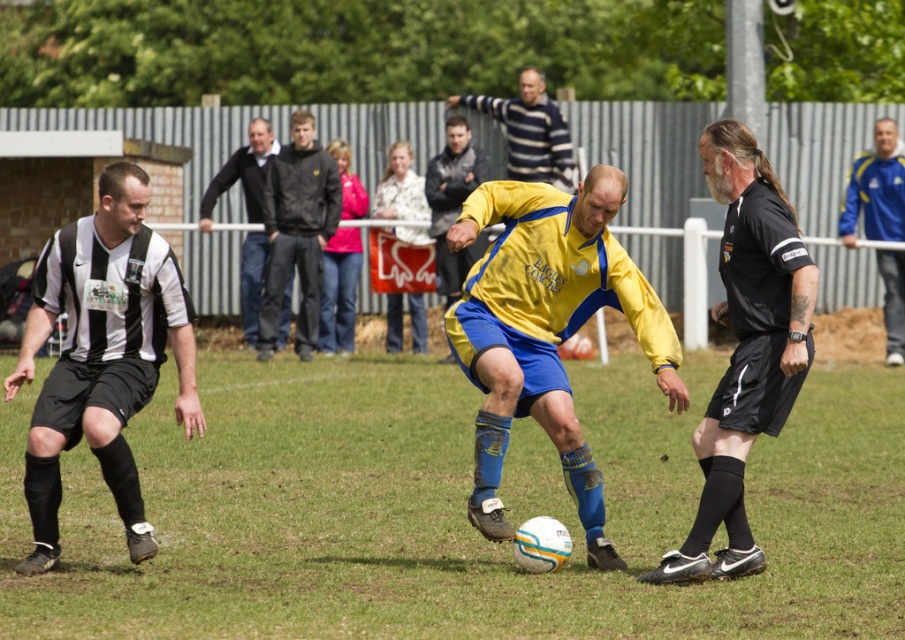
Does white matte soccer ball at center have a greater width compared to black matte referee shirt at right?

Yes, white matte soccer ball at center is wider than black matte referee shirt at right.

Is white matte soccer ball at center behind black matte referee shirt at right?

No, it is in front of black matte referee shirt at right.

Who is more forward, (245, 445) or (736, 332)?

Point (736, 332) is more forward.

At what (x,y) coordinates should I click in order to perform the action: click on white matte soccer ball at center. Please return your answer as a coordinate pair (x, y). This screenshot has width=905, height=640. Looking at the image, I should click on (456, 512).

Is point (443, 609) farther from camera compared to point (129, 396)?

No, (443, 609) is closer to viewer.

Which of these two, white matte soccer ball at center or black and white jersey at left, stands shorter?

Standing shorter between the two is white matte soccer ball at center.

Does point (322, 566) come farther from viewer compared to point (83, 396)?

Yes, it is behind point (83, 396).

Locate an element on the screen. The height and width of the screenshot is (640, 905). white matte soccer ball at center is located at coordinates (456, 512).

Does white matte soccer ball at center have a smaller size compared to black jersey at upper center?

No, white matte soccer ball at center is not smaller than black jersey at upper center.

Based on the photo, does white matte soccer ball at center appear over black jersey at upper center?

No.

Is point (463, 468) positioned after point (201, 205)?

No, (463, 468) is closer to viewer.

This screenshot has width=905, height=640. What are the coordinates of `white matte soccer ball at center` in the screenshot? It's located at (456, 512).